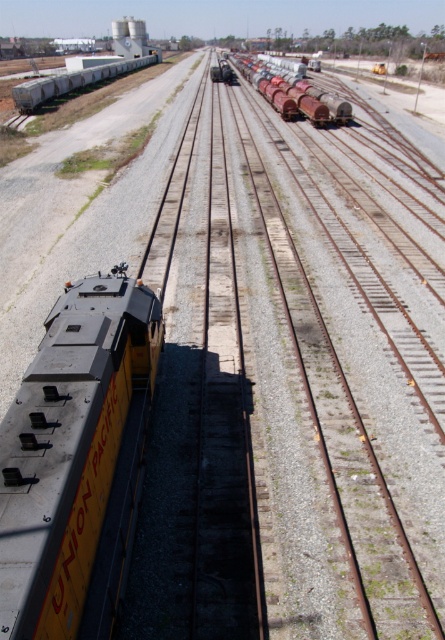
Does yellow matte train at center have a lesser width compared to white matte train car at upper left?

Yes.

Does yellow matte train at center appear over white matte train car at upper left?

No, yellow matte train at center is not above white matte train car at upper left.

Is point (94, 618) positioned behind point (72, 92)?

No.

You are a GUI agent. You are given a task and a screenshot of the screen. Output one action in this format:
    pyautogui.click(x=<x>, y=<y>)
    Task: Click on the yellow matte train at center
    The height and width of the screenshot is (640, 445).
    Given the screenshot: What is the action you would take?
    pyautogui.click(x=69, y=448)

Does yellow matte train at center appear under reddish-brown tank cars at upper right?

Correct, yellow matte train at center is located below reddish-brown tank cars at upper right.

Image resolution: width=445 pixels, height=640 pixels. I want to click on yellow matte train at center, so click(x=69, y=448).

Which is behind, point (105, 449) or point (254, 84)?

Positioned behind is point (254, 84).

I want to click on yellow matte train at center, so click(69, 448).

Can you confirm if reddish-brown tank cars at upper right is thinner than white matte train car at upper left?

No.

Is point (327, 109) positioned after point (148, 60)?

No, (327, 109) is closer to viewer.

The image size is (445, 640). Find the location of `reddish-brown tank cars at upper right`. reddish-brown tank cars at upper right is located at coordinates (295, 93).